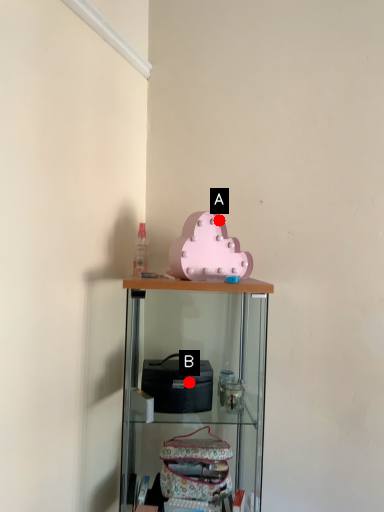
Question: Two points are circled on the image, labeled by A and B beside each circle. Among these points, which one is nearest to the camera?

Choices:
 (A) A is closer
 (B) B is closer

Answer: (B)